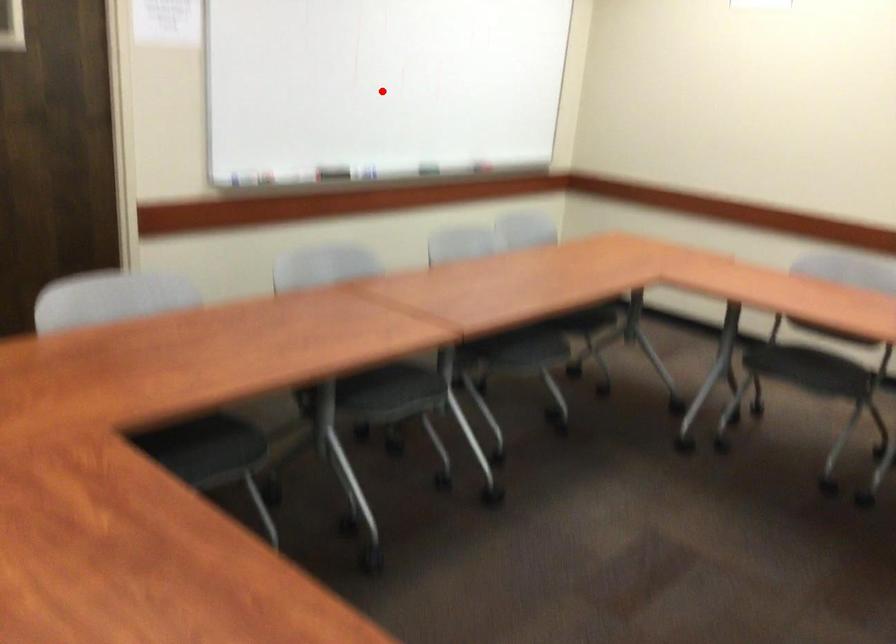
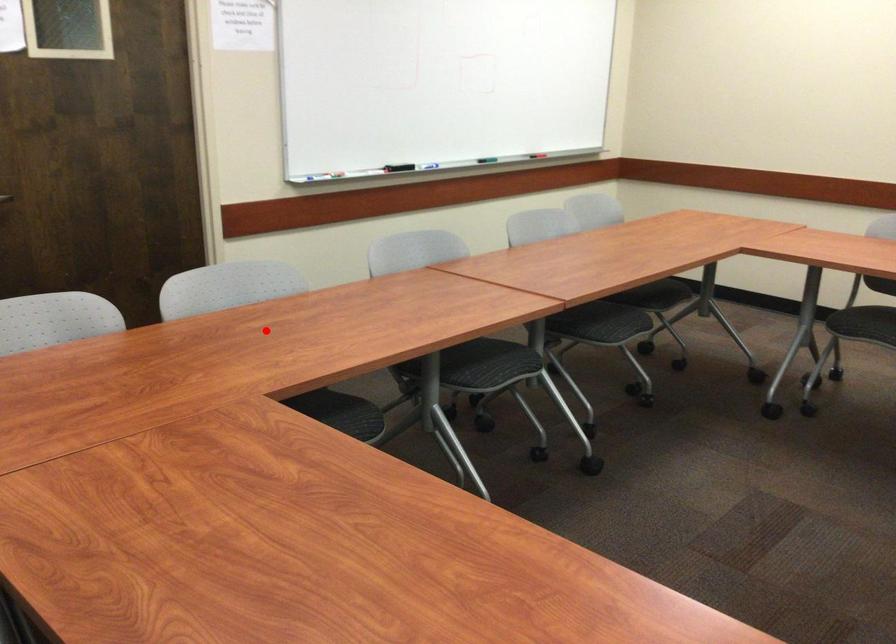
I am providing you with two images of the same scene from different viewpoints. A red point is marked on the first image and another point is marked on the second image. Does the point marked in image1 correspond to the same location as the one in image2?

No